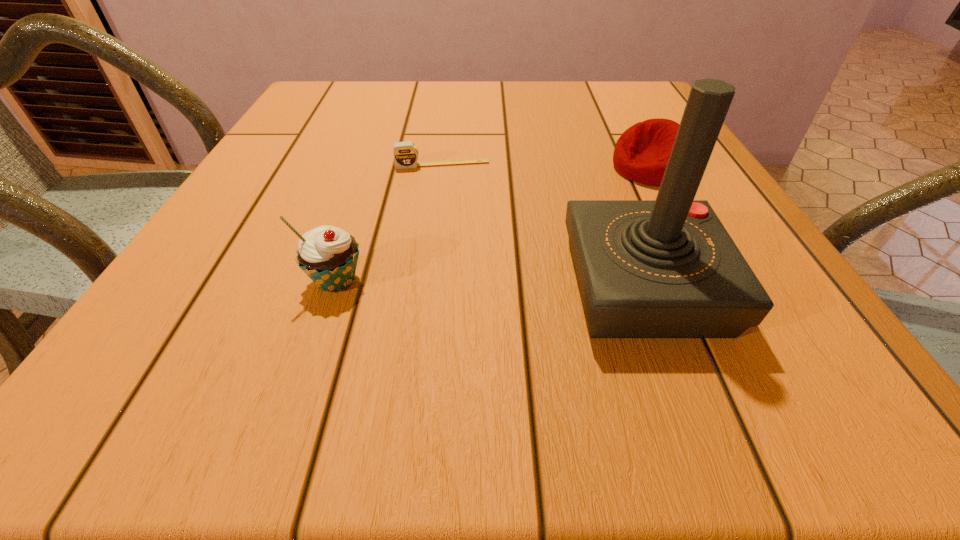
Identify the location of cupcake. The image size is (960, 540). (328, 255).

The width and height of the screenshot is (960, 540). I want to click on the tallest object, so click(x=667, y=268).

Locate an element on the screen. This screenshot has width=960, height=540. tape measure is located at coordinates (406, 153).

Where is `beanbag`? Image resolution: width=960 pixels, height=540 pixels. beanbag is located at coordinates (641, 154).

The width and height of the screenshot is (960, 540). I want to click on free location located on the back of the second tallest object, so click(362, 205).

Locate an element on the screen. The image size is (960, 540). vacant space located on the rectangular base of the tallest object is located at coordinates (337, 286).

I want to click on vacant region located 0.300m on the rectangular base of the tallest object, so click(364, 286).

I want to click on free region located 0.370m on the rectangular base of the tallest object, so click(316, 286).

In order to click on vacant space situated 0.390m at the front of the shortest object with the tape extended in this screenshot , I will do `click(464, 318)`.

At what (x,y) coordinates should I click in order to perform the action: click on vacant region located at the front of the shortest object with the tape extended. Please return your answer as a coordinate pair (x, y). The width and height of the screenshot is (960, 540). Looking at the image, I should click on (464, 318).